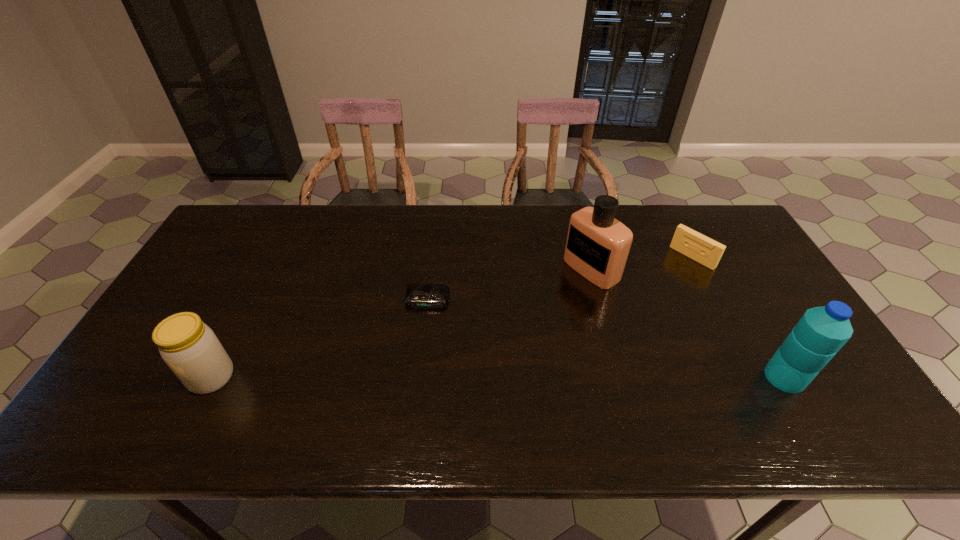
At what (x,y) coordinates should I click in order to perform the action: click on free space located 0.160m on the display of the third farthest object. Please return your answer as a coordinate pair (x, y). Image resolution: width=960 pixels, height=540 pixels. Looking at the image, I should click on (418, 357).

In order to click on vacant space located on the display of the third farthest object in this screenshot , I will do `click(416, 370)`.

Locate an element on the screen. free space located 0.300m on the front label of the perfume is located at coordinates (495, 329).

The image size is (960, 540). Find the location of `vacant space located on the front label of the perfume`. vacant space located on the front label of the perfume is located at coordinates (501, 326).

This screenshot has width=960, height=540. What are the coordinates of `vacant space situated on the front label of the perfume` in the screenshot? It's located at (549, 296).

Image resolution: width=960 pixels, height=540 pixels. Identify the location of vacant space located at the front of the second shortest object with spools. (642, 300).

You are a GUI agent. You are given a task and a screenshot of the screen. Output one action in this format:
    pyautogui.click(x=<x>, y=<y>)
    Task: Click on the vacant space located 0.400m at the front of the second shortest object with spools
    
    Given the screenshot: What is the action you would take?
    pyautogui.click(x=604, y=333)

Find the location of a particular element. vacant point located at the front of the second shortest object with spools is located at coordinates (642, 300).

You are a GUI agent. You are given a task and a screenshot of the screen. Output one action in this format:
    pyautogui.click(x=<x>, y=<y>)
    Task: Click on the object at the far edge
    This screenshot has width=960, height=540.
    Given the screenshot: What is the action you would take?
    pyautogui.click(x=706, y=251)

At what (x,y) coordinates should I click in order to perform the action: click on jar that is at the near edge. Please return your answer as a coordinate pair (x, y). The image size is (960, 540). Looking at the image, I should click on (190, 348).